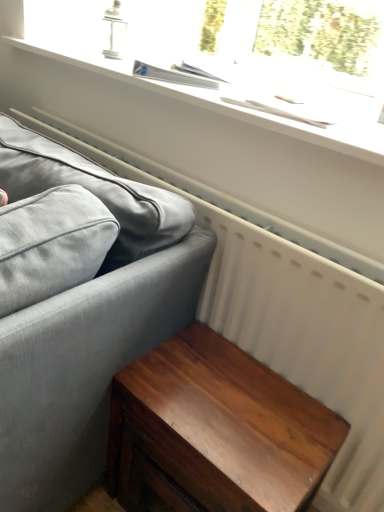
You are a GUI agent. You are given a task and a screenshot of the screen. Output one action in this format:
    pyautogui.click(x=<x>, y=<y>)
    Task: Click on the shiny brown wood table at lower right
    The image size is (384, 512).
    Given the screenshot: What is the action you would take?
    pyautogui.click(x=216, y=430)

Measure the distance between point (10,38) and camera.

Point (10,38) and camera are 1.57 meters apart from each other.

Where is `shiny brown wood table at lower right`? shiny brown wood table at lower right is located at coordinates (216, 430).

What are the coordinates of `window behind the matte gray fabric couch at left` in the screenshot? It's located at [x=170, y=84].

Is matte gray fabric couch at left wider or thinner than white matte window sill at upper center?

matte gray fabric couch at left is thinner than white matte window sill at upper center.

Is point (6, 355) positioned in front of point (178, 95)?

Yes, it is in front of point (178, 95).

Is matte gray fabric couch at left taller or shorter than white matte window sill at upper center?

Clearly, matte gray fabric couch at left is taller compared to white matte window sill at upper center.

Can white matte window sill at upper center be found inside shiny brown wood table at lower right?

No, white matte window sill at upper center is not surrounded by shiny brown wood table at lower right.

From the image's perspective, is shiny brown wood table at lower right under white matte window sill at upper center?

Correct, shiny brown wood table at lower right appears lower than white matte window sill at upper center in the image.

Could you tell me if shiny brown wood table at lower right is facing white matte window sill at upper center?

No.

In the scene shown: How different are the orientations of shiny brown wood table at lower right and white matte window sill at upper center in degrees?

They differ by 0.851 degrees in their facing directions.

Looking at this image, which object is positioned more to the left, white matte window sill at upper center or matte gray fabric couch at left?

Positioned to the left is matte gray fabric couch at left.

Measure the distance from white matte window sill at upper center to matte gray fabric couch at left.

A distance of 23.05 inches exists between white matte window sill at upper center and matte gray fabric couch at left.

Which is correct: white matte window sill at upper center is inside matte gray fabric couch at left, or outside of it?

white matte window sill at upper center lies outside matte gray fabric couch at left.

From the picture: Who is shorter, white matte window sill at upper center or matte gray fabric couch at left?

Standing shorter between the two is white matte window sill at upper center.

Considering the positions of point (210, 408) and point (149, 267), is point (210, 408) closer or farther from the camera than point (149, 267)?

Point (210, 408) appears to be farther away from the viewer than point (149, 267).

Where is `table below the matte gray fabric couch at left (from a real-world perspective)`? This screenshot has width=384, height=512. table below the matte gray fabric couch at left (from a real-world perspective) is located at coordinates (216, 430).

Visually, is shiny brown wood table at lower right positioned to the left or to the right of matte gray fabric couch at left?

Clearly, shiny brown wood table at lower right is on the right of matte gray fabric couch at left in the image.

Could you tell me if white matte window sill at upper center is turned towards shiny brown wood table at lower right?

No, white matte window sill at upper center is not oriented towards shiny brown wood table at lower right.

Does white matte window sill at upper center touch shiny brown wood table at lower right?

No, white matte window sill at upper center is not touching shiny brown wood table at lower right.

Which is more to the left, white matte window sill at upper center or shiny brown wood table at lower right?

white matte window sill at upper center.

You are a GUI agent. You are given a task and a screenshot of the screen. Output one action in this format:
    pyautogui.click(x=<x>, y=<y>)
    Task: Click on the window above the shiny brown wood table at lower right (from the image's perspective)
    The image size is (384, 512).
    Given the screenshot: What is the action you would take?
    pyautogui.click(x=170, y=84)

Is matte gray fabric couch at left next to shiny brown wood table at lower right and touching it?

No, matte gray fabric couch at left is not making contact with shiny brown wood table at lower right.

Considering the points (20, 194) and (261, 470), which point is behind, point (20, 194) or point (261, 470)?

The point (20, 194) is farther.

From the picture: Could you tell me if matte gray fabric couch at left is facing shiny brown wood table at lower right?

Yes, matte gray fabric couch at left faces towards shiny brown wood table at lower right.

The width and height of the screenshot is (384, 512). In order to click on window behind the matte gray fabric couch at left in this screenshot , I will do `click(170, 84)`.

Where is `window that appears above the shiny brown wood table at lower right (from a real-world perspective)`? Image resolution: width=384 pixels, height=512 pixels. window that appears above the shiny brown wood table at lower right (from a real-world perspective) is located at coordinates (170, 84).

Considering their positions, is shiny brown wood table at lower right positioned closer to matte gray fabric couch at left than white matte window sill at upper center?

shiny brown wood table at lower right is positioned closer to the anchor matte gray fabric couch at left.

Looking at the image, which one is located closer to shiny brown wood table at lower right, matte gray fabric couch at left or white matte window sill at upper center?

Based on the image, matte gray fabric couch at left appears to be nearer to shiny brown wood table at lower right.

Which object lies nearer to the anchor point white matte window sill at upper center, matte gray fabric couch at left or shiny brown wood table at lower right?

matte gray fabric couch at left is positioned closer to the anchor white matte window sill at upper center.

Based on their spatial positions, is white matte window sill at upper center or matte gray fabric couch at left closer to shiny brown wood table at lower right?

Among the two, matte gray fabric couch at left is located nearer to shiny brown wood table at lower right.

Which object lies further to the anchor point matte gray fabric couch at left, white matte window sill at upper center or shiny brown wood table at lower right?

The object further to matte gray fabric couch at left is white matte window sill at upper center.

From the image, which object appears to be nearer to white matte window sill at upper center, shiny brown wood table at lower right or matte gray fabric couch at left?

matte gray fabric couch at left is positioned closer to the anchor white matte window sill at upper center.

I want to click on studio couch between white matte window sill at upper center and shiny brown wood table at lower right from top to bottom, so click(86, 322).